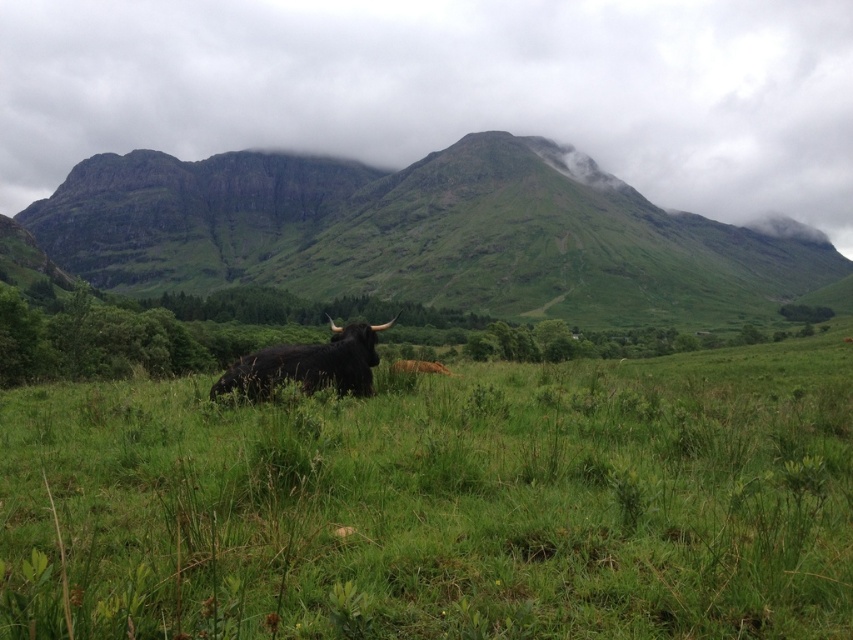
Question: Does green grassy mountain at upper center have a lesser width compared to black furry bull at center?

Choices:
 (A) yes
 (B) no

Answer: (B)

Question: Estimate the real-world distances between objects in this image. Which object is closer to the green grassy field at center?

Choices:
 (A) black furry bull at center
 (B) green grassy mountain at upper center

Answer: (A)

Question: Which of the following is the closest to the observer?

Choices:
 (A) black furry bull at center
 (B) green grassy field at center

Answer: (B)

Question: Can you confirm if green grassy field at center is smaller than black furry bull at center?

Choices:
 (A) no
 (B) yes

Answer: (A)

Question: Does green grassy field at center have a greater width compared to black furry bull at center?

Choices:
 (A) yes
 (B) no

Answer: (A)

Question: Which point appears farthest from the camera in this image?

Choices:
 (A) (254, 387)
 (B) (161, 198)

Answer: (B)